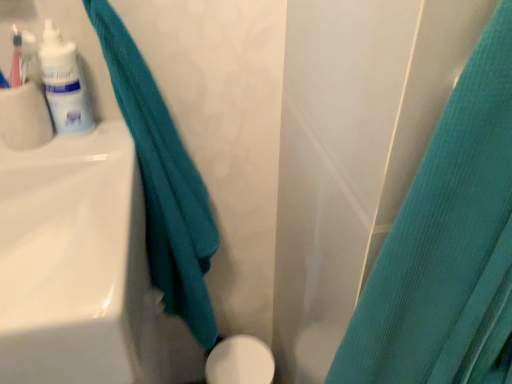
Question: From the image's perspective, relative to white glossy lotion at upper left, is teal fabric towel at left, the 1th curtain positioned from the left, above or below?

Choices:
 (A) below
 (B) above

Answer: (A)

Question: Relative to white glossy lotion at upper left, is teal fabric towel at left, the second curtain in the right-to-left sequence, in front or behind?

Choices:
 (A) behind
 (B) front

Answer: (B)

Question: Estimate the real-world distances between objects in this image. Which object is farther from the white glossy sink at left?

Choices:
 (A) white glossy porcelain at lower center
 (B) teal fabric curtain at right, which is the first curtain from right to left
 (C) teal fabric towel at left, the second curtain in the right-to-left sequence
 (D) white glossy lotion at upper left

Answer: (A)

Question: Which of these objects is positioned closest to the white glossy lotion at upper left?

Choices:
 (A) white glossy sink at left
 (B) white glossy porcelain at lower center
 (C) teal fabric curtain at right, which is the first curtain from right to left
 (D) teal fabric towel at left, the 1th curtain positioned from the left

Answer: (D)